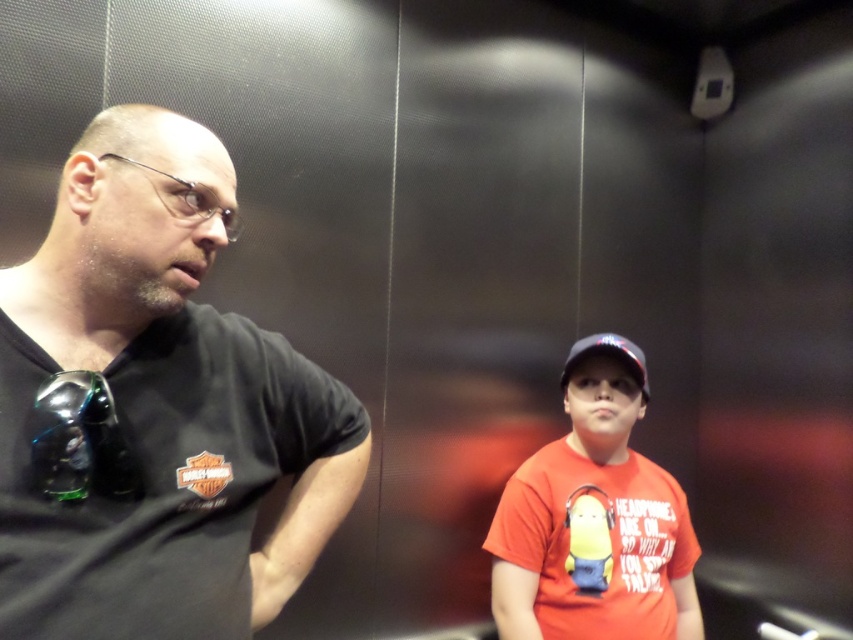
Question: Is orange matte t-shirt at center positioned at the back of black fabric baseball cap at upper right?

Choices:
 (A) no
 (B) yes

Answer: (A)

Question: Which of the following is the closest to the observer?

Choices:
 (A) orange matte t-shirt at center
 (B) black fabric baseball cap at upper right
 (C) black matte shirt at left

Answer: (C)

Question: Which point is farther to the camera?

Choices:
 (A) (549, 600)
 (B) (84, 316)

Answer: (A)

Question: Is black matte shirt at left positioned in front of orange matte t-shirt at center?

Choices:
 (A) no
 (B) yes

Answer: (B)

Question: Which of the following is the closest to the observer?

Choices:
 (A) black fabric baseball cap at upper right
 (B) black matte shirt at left
 (C) orange matte t-shirt at center

Answer: (B)

Question: Is black matte shirt at left above orange matte t-shirt at center?

Choices:
 (A) yes
 (B) no

Answer: (A)